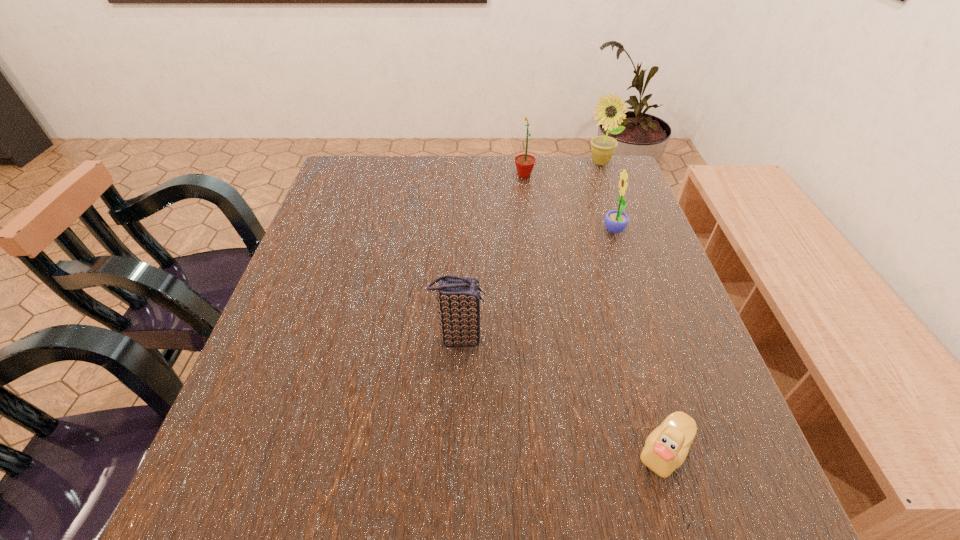
At what (x,y) coordinates should I click in order to perform the action: click on the leftmost sunflower. Please return your answer as a coordinate pair (x, y). This screenshot has height=540, width=960. Looking at the image, I should click on (524, 163).

Identify the location of the third nearest object. (616, 221).

This screenshot has width=960, height=540. I want to click on clutch bag, so click(x=458, y=299).

Image resolution: width=960 pixels, height=540 pixels. I want to click on the leftmost object, so click(x=458, y=299).

The image size is (960, 540). Find the location of `the nearest object`. the nearest object is located at coordinates (666, 448).

Find the location of `the shortest object`. the shortest object is located at coordinates [x=666, y=448].

What are the coordinates of `blank space located on the face of the second object from left to right` in the screenshot? It's located at (381, 175).

Where is `vacant space located 0.140m on the face of the second object from left to right`? vacant space located 0.140m on the face of the second object from left to right is located at coordinates (467, 175).

You are a GUI agent. You are given a task and a screenshot of the screen. Output one action in this format:
    pyautogui.click(x=<x>, y=<y>)
    Task: Click on the free space located on the face of the second object from left to right
    
    Given the screenshot: What is the action you would take?
    pyautogui.click(x=432, y=175)

This screenshot has height=540, width=960. Find the location of `vacant space located 0.170m on the front-facing side of the third nearest object`. vacant space located 0.170m on the front-facing side of the third nearest object is located at coordinates (536, 231).